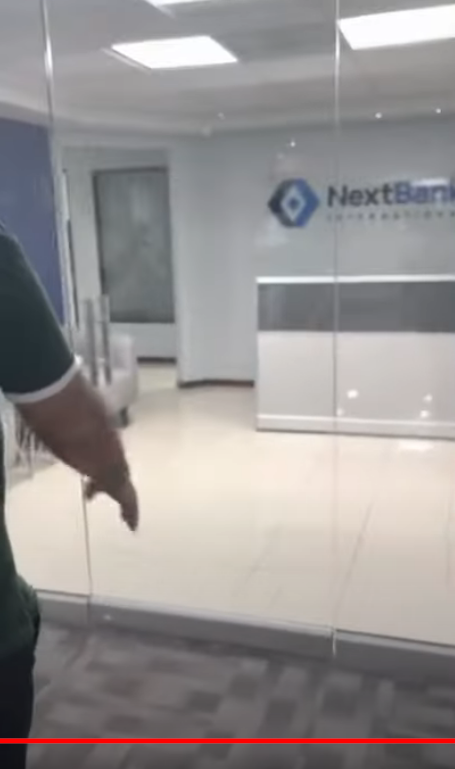
At what (x,y) coordinates should I click in order to perform the action: click on door handle. Please return your answer as a coordinate pair (x, y). Looking at the image, I should click on (107, 338), (91, 335).